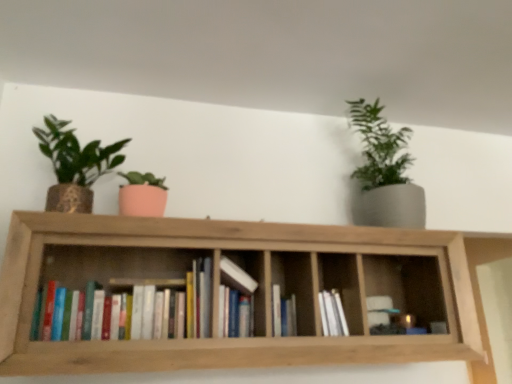
Question: From the image's perspective, is hardcover book at center, which is the first book from right to left, above or below hardcover books at center, the 3th book when ordered from right to left?

Choices:
 (A) below
 (B) above

Answer: (A)

Question: In the image, is hardcover book at center, which is the first book from right to left, positioned in front of or behind hardcover books at center, which appears as the 1th book when viewed from the left?

Choices:
 (A) front
 (B) behind

Answer: (B)

Question: Estimate the real-world distances between objects in this image. Which object is farther from the hardcover books at center, the 3th book when ordered from right to left?

Choices:
 (A) matte gold pot at left, which appears as the second houseplant when viewed from the right
 (B) white matte books at center
 (C) matte gray pot at upper right, the first houseplant from the right
 (D) hardcover book at center, the third book viewed from the left
 (E) wooden bookshelf at center

Answer: (C)

Question: Estimate the real-world distances between objects in this image. Which object is closer to the matte gold pot at left, which is the 1th houseplant from left to right?

Choices:
 (A) white matte books at center
 (B) hardcover books at center, which appears as the 1th book when viewed from the left
 (C) hardcover book at center, the third book viewed from the left
 (D) wooden bookshelf at center
 (E) matte gray pot at upper right, the first houseplant from the right

Answer: (B)